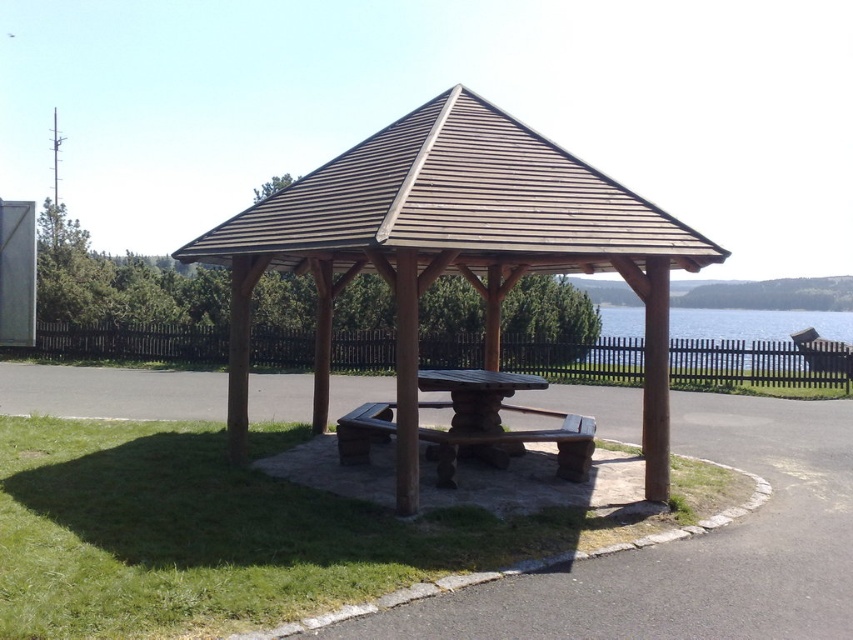
Who is taller, brown wooden gazebo at center or rustic wood bench at center?

rustic wood bench at center

Is brown wooden gazebo at center to the right of rustic wood bench at center from the viewer's perspective?

In fact, brown wooden gazebo at center is to the left of rustic wood bench at center.

The image size is (853, 640). Find the location of `brown wooden gazebo at center`. brown wooden gazebo at center is located at coordinates (456, 269).

Which is above, rustic wood bench at center or rustic wood table at center?

rustic wood table at center

Between rustic wood bench at center and rustic wood table at center, which one is positioned lower?

rustic wood bench at center

Who is more forward, (558, 454) or (463, 397)?

Positioned in front is point (558, 454).

At what (x,y) coordinates should I click in order to perform the action: click on rustic wood bench at center. Please return your answer as a coordinate pair (x, y). Looking at the image, I should click on (514, 445).

From the picture: Which is more to the left, brown wooden gazebo at center or rustic wood table at center?

Positioned to the left is brown wooden gazebo at center.

At what (x,y) coordinates should I click in order to perform the action: click on brown wooden gazebo at center. Please return your answer as a coordinate pair (x, y). This screenshot has height=640, width=853. Looking at the image, I should click on tap(456, 269).